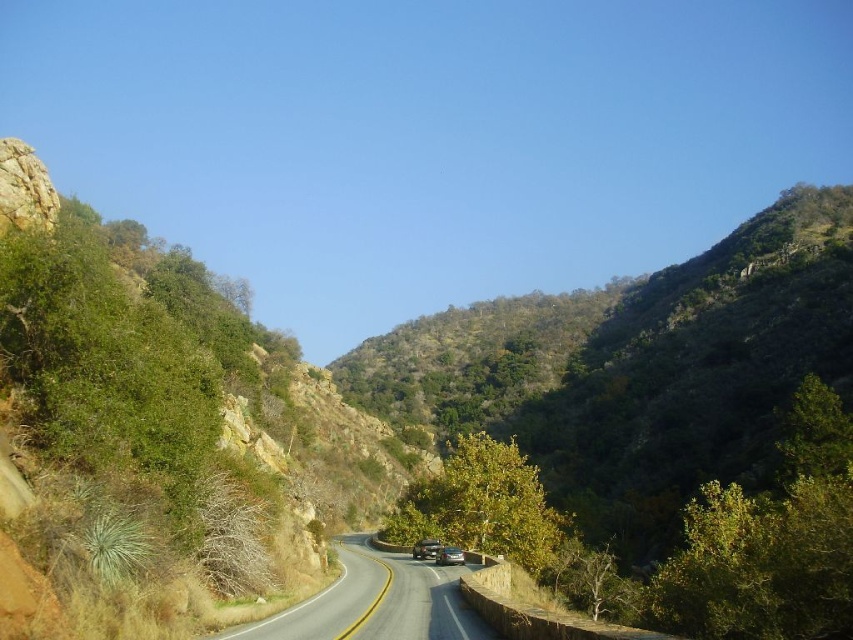
Question: Does black asphalt road at center have a lesser width compared to shiny silver sedan at center?

Choices:
 (A) no
 (B) yes

Answer: (A)

Question: Among these objects, which one is farthest from the camera?

Choices:
 (A) shiny silver sedan at center
 (B) black asphalt road at center

Answer: (A)

Question: Is black asphalt road at center thinner than shiny silver sedan at center?

Choices:
 (A) yes
 (B) no

Answer: (B)

Question: From the image, what is the correct spatial relationship of black asphalt road at center in relation to shiny silver sedan at center?

Choices:
 (A) below
 (B) above

Answer: (B)

Question: Which point is farther to the camera?

Choices:
 (A) click(306, 598)
 (B) click(413, 554)

Answer: (B)